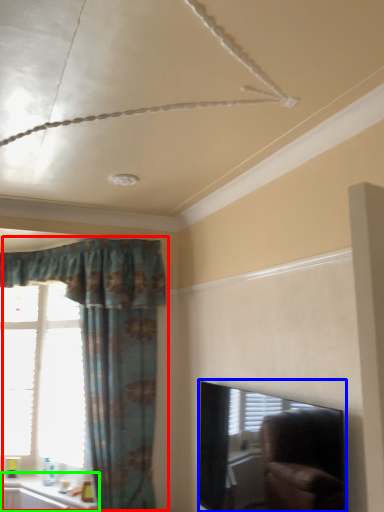
Question: Based on their relative distances, which object is farther from curtain (highlighted by a red box)? Choose from window screen (highlighted by a blue box) and window sill (highlighted by a green box).

Choices:
 (A) window screen
 (B) window sill

Answer: (A)